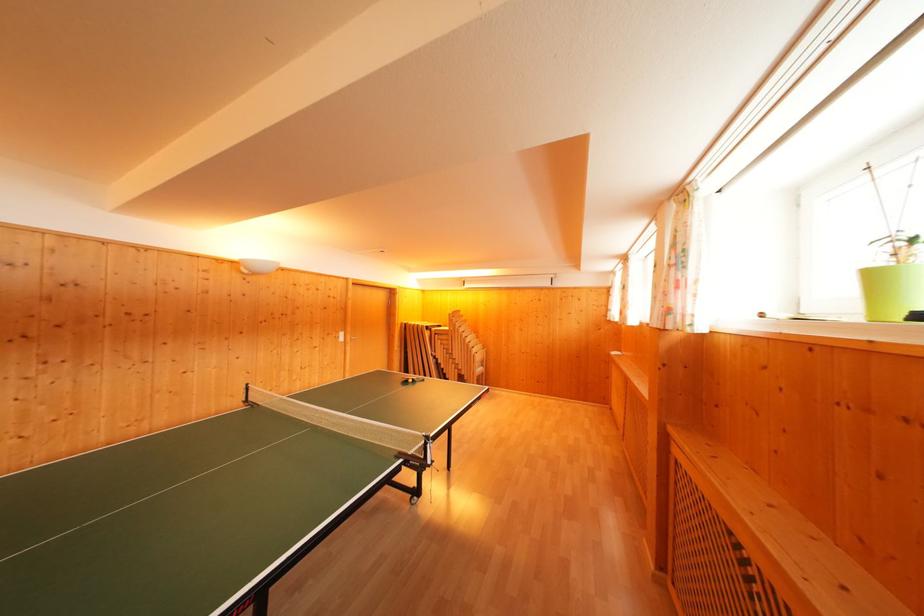
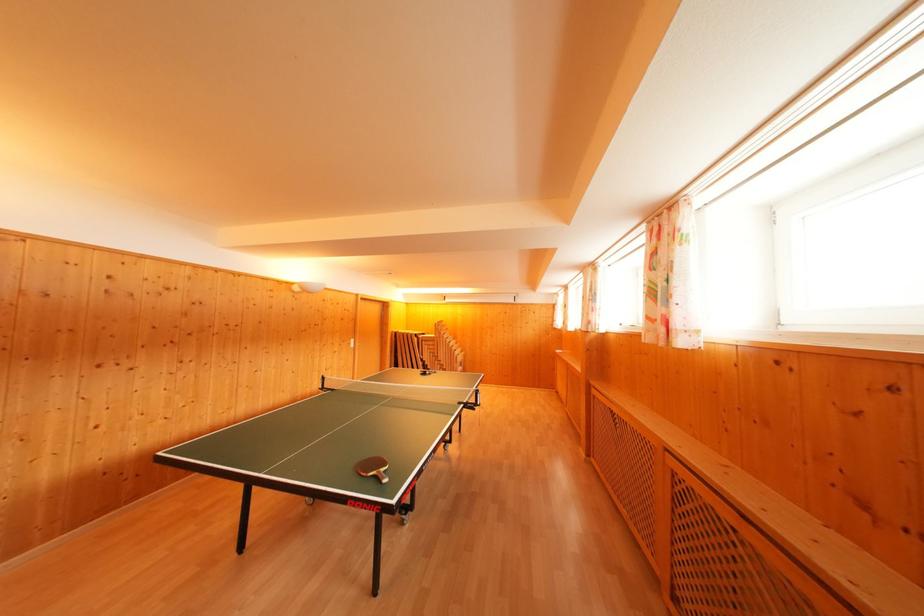
Based on the photo, the images are taken continuously from a first-person perspective. In which direction are you moving?

The cameraman walked toward left, backward.